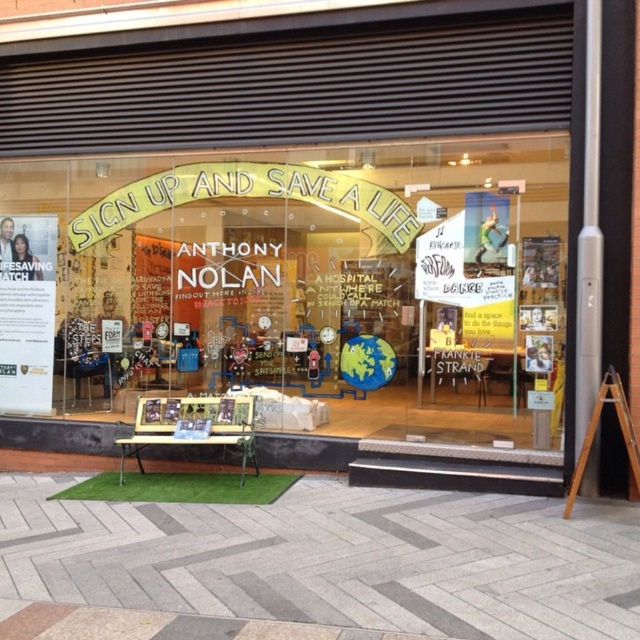
Question: Is matte glass sign at center smaller than wooden sign at lower right?

Choices:
 (A) yes
 (B) no

Answer: (A)

Question: Is matte glass sign at center behind wooden sign at lower right?

Choices:
 (A) yes
 (B) no

Answer: (A)

Question: Which point appears farthest from the camera in this image?

Choices:
 (A) (577, 467)
 (B) (262, 305)

Answer: (B)

Question: Which point appears closest to the camera in this image?

Choices:
 (A) (355, 200)
 (B) (573, 500)

Answer: (B)

Question: Can you confirm if matte glass sign at center is thinner than wooden sign at lower right?

Choices:
 (A) no
 (B) yes

Answer: (B)

Question: Among these objects, which one is nearest to the camera?

Choices:
 (A) matte glass sign at center
 (B) wooden sign at lower right

Answer: (B)